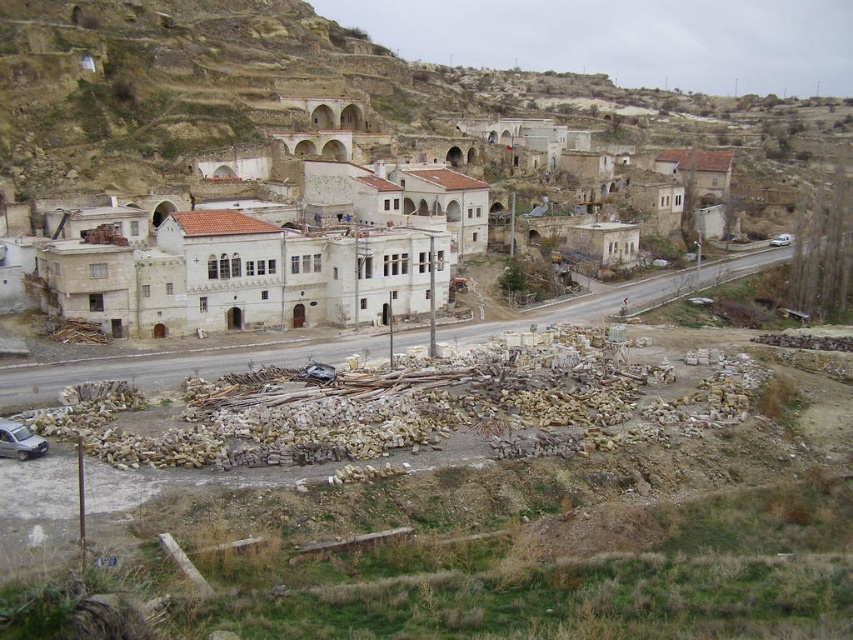
Is white stone buildings at center above stone rubble at center?

Correct, white stone buildings at center is located above stone rubble at center.

Is white stone buildings at center to the right of stone rubble at center from the viewer's perspective?

Incorrect, white stone buildings at center is not on the right side of stone rubble at center.

Which is in front, point (329, 305) or point (508, 378)?

Point (508, 378)

Locate an element on the screen. white stone buildings at center is located at coordinates (267, 256).

Who is positioned more to the right, stone rubble at center or silver metallic car at lower left?

From the viewer's perspective, stone rubble at center appears more on the right side.

Between point (560, 388) and point (35, 444), which one is positioned in front?

Point (35, 444)

Is point (682, 432) behind point (3, 442)?

Yes.

Identify the location of stone rubble at center. The height and width of the screenshot is (640, 853). (410, 406).

Is white stone buildings at center above silver metallic car at lower left?

Yes.

What do you see at coordinates (267, 256) in the screenshot? This screenshot has width=853, height=640. I see `white stone buildings at center` at bounding box center [267, 256].

The image size is (853, 640). What are the coordinates of `white stone buildings at center` in the screenshot? It's located at [x=267, y=256].